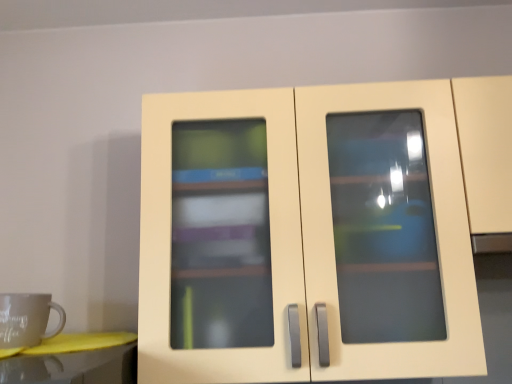
Question: Relative to matte gray mug at left, is matte cream cupboard at center in front or behind?

Choices:
 (A) behind
 (B) front

Answer: (B)

Question: Based on their sizes in the image, would you say matte cream cupboard at center is bigger or smaller than matte gray mug at left?

Choices:
 (A) big
 (B) small

Answer: (A)

Question: From the image's perspective, is matte cream cupboard at center positioned above or below matte gray mug at left?

Choices:
 (A) below
 (B) above

Answer: (B)

Question: Considering the relative positions of matte gray mug at left and matte cream cupboard at center in the image provided, is matte gray mug at left to the left or to the right of matte cream cupboard at center?

Choices:
 (A) left
 (B) right

Answer: (A)

Question: Is matte gray mug at left inside or outside of matte cream cupboard at center?

Choices:
 (A) outside
 (B) inside

Answer: (A)

Question: In terms of size, does matte gray mug at left appear bigger or smaller than matte cream cupboard at center?

Choices:
 (A) big
 (B) small

Answer: (B)

Question: From a real-world perspective, is matte gray mug at left above or below matte cream cupboard at center?

Choices:
 (A) above
 (B) below

Answer: (B)